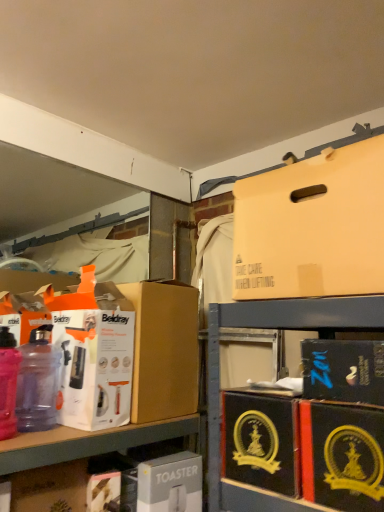
Question: From a real-world perspective, is white cardboard toaster at lower center, which is counted as the first box, starting from the bottom, physically above matte cardboard box at lower left?

Choices:
 (A) yes
 (B) no

Answer: (B)

Question: Is white cardboard toaster at lower center, which is counted as the first box, starting from the bottom, positioned before matte cardboard box at lower left?

Choices:
 (A) no
 (B) yes

Answer: (A)

Question: Is white cardboard toaster at lower center, which ranks as the 6th box in top-to-bottom order, oriented towards matte cardboard box at lower left?

Choices:
 (A) yes
 (B) no

Answer: (B)

Question: From the image's perspective, does white cardboard toaster at lower center, which ranks as the 6th box in top-to-bottom order, appear lower than matte cardboard box at lower left?

Choices:
 (A) yes
 (B) no

Answer: (A)

Question: From the image's perspective, is white cardboard toaster at lower center, which ranks as the 6th box in top-to-bottom order, located above matte cardboard box at lower left?

Choices:
 (A) no
 (B) yes

Answer: (A)

Question: Is white cardboard toaster at lower center, which ranks as the 6th box in top-to-bottom order, at the right side of matte cardboard box at lower left?

Choices:
 (A) yes
 (B) no

Answer: (A)

Question: From the image's perspective, would you say black cardboard box at lower right, the fifth box in the top-to-bottom sequence, is positioned over black cardboard box at lower right, the 3th box when ordered from bottom to top?

Choices:
 (A) yes
 (B) no

Answer: (B)

Question: Considering the relative sizes of black cardboard box at lower right, the second box ordered from the bottom, and black cardboard box at lower right, the 3th box when ordered from bottom to top, in the image provided, is black cardboard box at lower right, the second box ordered from the bottom, wider than black cardboard box at lower right, the 3th box when ordered from bottom to top,?

Choices:
 (A) no
 (B) yes

Answer: (A)

Question: Is black cardboard box at lower right, which is counted as the 4th box, starting from the top, surrounded by black cardboard box at lower right, the second box ordered from the bottom?

Choices:
 (A) yes
 (B) no

Answer: (B)

Question: From a real-world perspective, is black cardboard box at lower right, the second box ordered from the bottom, beneath black cardboard box at lower right, which is counted as the 4th box, starting from the top?

Choices:
 (A) no
 (B) yes

Answer: (A)

Question: Does black cardboard box at lower right, the second box ordered from the bottom, lie in front of black cardboard box at lower right, which is counted as the 4th box, starting from the top?

Choices:
 (A) no
 (B) yes

Answer: (A)

Question: Is black cardboard box at lower right, the second box ordered from the bottom, not inside black cardboard box at lower right, which is counted as the 4th box, starting from the top?

Choices:
 (A) yes
 (B) no

Answer: (A)

Question: Does matte cardboard box at upper right, which is the 6th box from bottom to top, have a lesser width compared to matte cardboard box at lower left?

Choices:
 (A) yes
 (B) no

Answer: (B)